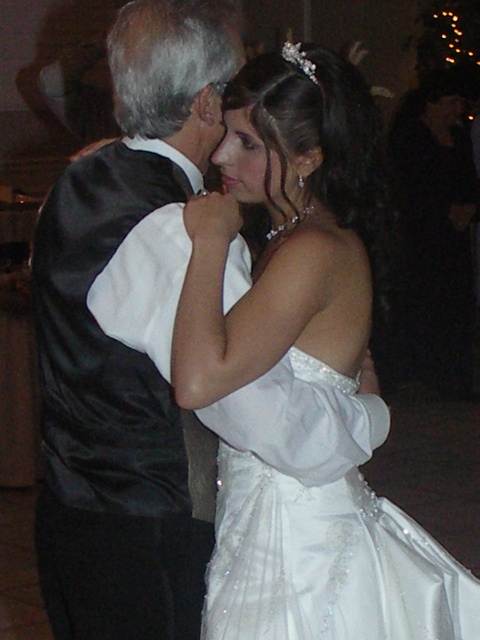
Consider the image. Who is higher up, satin black vest at left or satin/embroidered dress at center?

satin black vest at left

Can you confirm if satin black vest at left is taller than satin/embroidered dress at center?

Correct, satin black vest at left is much taller as satin/embroidered dress at center.

Is point (133, 12) less distant than point (433, 552)?

Yes, point (133, 12) is closer to viewer.

The width and height of the screenshot is (480, 640). I want to click on satin black vest at left, so click(123, 344).